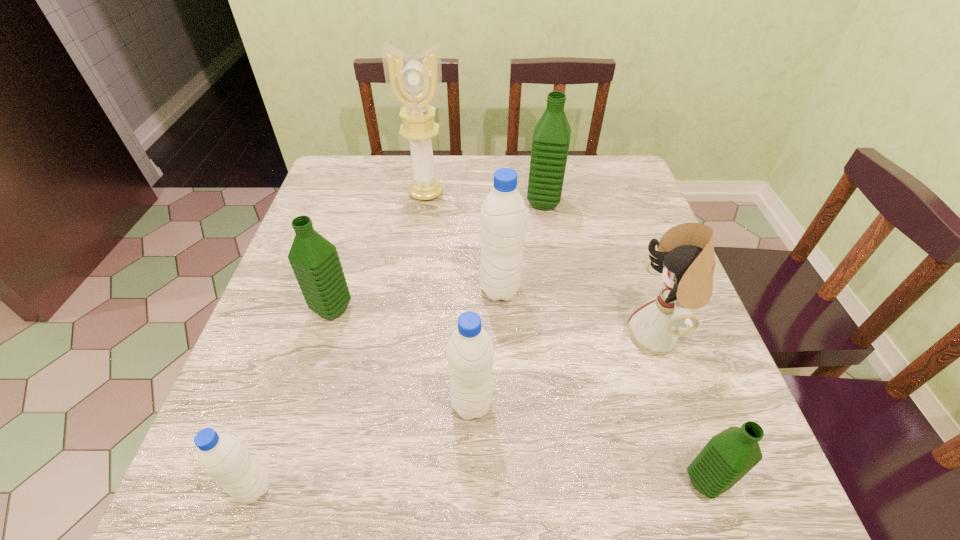
I want to click on the tallest object, so click(414, 84).

Where is `the third object from left to right`? Image resolution: width=960 pixels, height=540 pixels. the third object from left to right is located at coordinates (414, 84).

Where is `the second water bottle from right to left`? The image size is (960, 540). the second water bottle from right to left is located at coordinates (551, 138).

Locate an element on the screen. The height and width of the screenshot is (540, 960). the sixth object from left to right is located at coordinates (551, 138).

The width and height of the screenshot is (960, 540). I want to click on the farthest gray water bottle, so pyautogui.click(x=503, y=217).

The image size is (960, 540). Identify the location of black doll. (685, 259).

At what (x,y) coordinates should I click in order to perform the action: click on the second farthest green water bottle. Please return your answer as a coordinate pair (x, y). Looking at the image, I should click on point(315,261).

Identify the location of the second biggest green water bottle. (315, 261).

This screenshot has width=960, height=540. I want to click on the third nearest object, so click(x=470, y=349).

Find the location of a particular element. the second biggest gray water bottle is located at coordinates (470, 349).